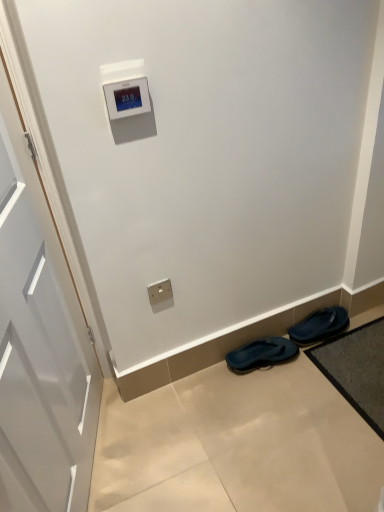
How much space does dark blue rubber flip-flops at lower right, the second footwear from the right, occupy vertically?

It is 3.65 inches.

This screenshot has width=384, height=512. I want to click on dark blue rubber flip-flops at lower right, the second footwear from the right, so click(x=261, y=354).

At what (x,y) coordinates should I click in order to perform the action: click on beige tile floor at lower center. Please return your answer as a coordinate pair (x, y). This screenshot has height=512, width=384. Looking at the image, I should click on (236, 445).

How different are the orientations of dark gray textured bath mat at lower right and beige tile floor at lower center in degrees?

The angular difference between dark gray textured bath mat at lower right and beige tile floor at lower center is 90 degrees.

Are dark gray textured bath mat at lower right and beige tile floor at lower center located far from each other?

No, dark gray textured bath mat at lower right is not far away from beige tile floor at lower center.

From the image's perspective, is dark gray textured bath mat at lower right on top of beige tile floor at lower center?

Yes.

Could you tell me if dark gray textured bath mat at lower right is facing beige tile floor at lower center?

Yes, dark gray textured bath mat at lower right is aimed at beige tile floor at lower center.

From a real-world perspective, which object rests below the other?

dark gray textured bath mat at lower right.

Are satin gold outlet at lower center and dark gray textured bath mat at lower right far apart?

satin gold outlet at lower center is near dark gray textured bath mat at lower right, not far away.

How many degrees apart are the facing directions of satin gold outlet at lower center and dark gray textured bath mat at lower right?

They differ by 90.1 degrees in their facing directions.

Locate an element on the screen. The height and width of the screenshot is (512, 384). bath mat located in front of the satin gold outlet at lower center is located at coordinates (356, 369).

How many degrees apart are the facing directions of beige tile floor at lower center and dark gray textured bath mat at lower right?

The angle between the facing direction of beige tile floor at lower center and the facing direction of dark gray textured bath mat at lower right is 90 degrees.

Which object is further away from the camera taking this photo, beige tile floor at lower center or dark gray textured bath mat at lower right?

dark gray textured bath mat at lower right is further away from the camera.

Considering the sizes of objects beige tile floor at lower center and dark gray textured bath mat at lower right in the image provided, who is shorter, beige tile floor at lower center or dark gray textured bath mat at lower right?

dark gray textured bath mat at lower right.

Based on their sizes in the image, would you say beige tile floor at lower center is bigger or smaller than dark gray textured bath mat at lower right?

Clearly, beige tile floor at lower center is larger in size than dark gray textured bath mat at lower right.

From the image's perspective, which footwear is the 1st one below the satin gold outlet at lower center? Please provide its 2D coordinates.

[(319, 325)]

Which of these two, black rubber slippers at lower right, the first footwear when ordered from right to left, or satin gold outlet at lower center, is wider?

black rubber slippers at lower right, the first footwear when ordered from right to left.

Considering the sizes of objects black rubber slippers at lower right, the first footwear when ordered from right to left, and satin gold outlet at lower center in the image provided, who is smaller, black rubber slippers at lower right, the first footwear when ordered from right to left, or satin gold outlet at lower center?

satin gold outlet at lower center is smaller.

Is satin gold outlet at lower center at the back of black rubber slippers at lower right, placed as the 2th footwear when sorted from left to right?

No, black rubber slippers at lower right, placed as the 2th footwear when sorted from left to right, is not facing away from satin gold outlet at lower center.

Does black rubber slippers at lower right, placed as the 2th footwear when sorted from left to right, turn towards dark blue rubber flip-flops at lower right, the 1th footwear viewed from the left?

No.

In the scene shown: In terms of size, does black rubber slippers at lower right, the first footwear when ordered from right to left, appear bigger or smaller than dark blue rubber flip-flops at lower right, the 1th footwear viewed from the left?

black rubber slippers at lower right, the first footwear when ordered from right to left, is smaller than dark blue rubber flip-flops at lower right, the 1th footwear viewed from the left.

How different are the orientations of black rubber slippers at lower right, the first footwear when ordered from right to left, and dark blue rubber flip-flops at lower right, the 1th footwear viewed from the left, in degrees?

The angle between the facing direction of black rubber slippers at lower right, the first footwear when ordered from right to left, and the facing direction of dark blue rubber flip-flops at lower right, the 1th footwear viewed from the left, is 0.00384 degrees.

From the image's perspective, which one is positioned higher, black rubber slippers at lower right, the first footwear when ordered from right to left, or dark blue rubber flip-flops at lower right, the 1th footwear viewed from the left?

black rubber slippers at lower right, the first footwear when ordered from right to left, from the image's perspective.

Can you see dark gray textured bath mat at lower right touching black rubber slippers at lower right, placed as the 2th footwear when sorted from left to right?

There is a gap between dark gray textured bath mat at lower right and black rubber slippers at lower right, placed as the 2th footwear when sorted from left to right.

Can we say dark gray textured bath mat at lower right lies outside black rubber slippers at lower right, the first footwear when ordered from right to left?

That's correct, dark gray textured bath mat at lower right is outside of black rubber slippers at lower right, the first footwear when ordered from right to left.

Which is closer, (365, 372) or (344, 310)?

Point (365, 372)

Is dark gray textured bath mat at lower right facing towards black rubber slippers at lower right, placed as the 2th footwear when sorted from left to right?

No, dark gray textured bath mat at lower right is not aimed at black rubber slippers at lower right, placed as the 2th footwear when sorted from left to right.

Is beige tile floor at lower center outside of satin gold outlet at lower center?

beige tile floor at lower center is positioned outside satin gold outlet at lower center.

Is point (302, 375) closer to camera compared to point (151, 298)?

That is False.

Is beige tile floor at lower center not close to satin gold outlet at lower center?

No, beige tile floor at lower center is not far away from satin gold outlet at lower center.

Could you tell me if beige tile floor at lower center is facing satin gold outlet at lower center?

No, beige tile floor at lower center is not oriented towards satin gold outlet at lower center.

The width and height of the screenshot is (384, 512). I want to click on bath mat behind the beige tile floor at lower center, so pyautogui.click(x=356, y=369).

Find the location of a particular element. The width and height of the screenshot is (384, 512). bath mat lying below the satin gold outlet at lower center (from the image's perspective) is located at coordinates (356, 369).

When comparing their distances from satin gold outlet at lower center, does black rubber slippers at lower right, the first footwear when ordered from right to left, or dark blue rubber flip-flops at lower right, the second footwear from the right, seem closer?

Based on the image, dark blue rubber flip-flops at lower right, the second footwear from the right, appears to be nearer to satin gold outlet at lower center.

Estimate the real-world distances between objects in this image. Which object is further from satin gold outlet at lower center, black rubber slippers at lower right, placed as the 2th footwear when sorted from left to right, or dark gray textured bath mat at lower right?

Based on the image, dark gray textured bath mat at lower right appears to be further to satin gold outlet at lower center.

When comparing their distances from satin gold outlet at lower center, does black rubber slippers at lower right, the first footwear when ordered from right to left, or beige tile floor at lower center seem closer?

beige tile floor at lower center is closer to satin gold outlet at lower center.

Looking at the image, which one is located further to black rubber slippers at lower right, placed as the 2th footwear when sorted from left to right, satin gold outlet at lower center or dark blue rubber flip-flops at lower right, the second footwear from the right?

satin gold outlet at lower center lies further to black rubber slippers at lower right, placed as the 2th footwear when sorted from left to right, than the other object.

When comparing their distances from dark blue rubber flip-flops at lower right, the second footwear from the right, does black rubber slippers at lower right, the first footwear when ordered from right to left, or dark gray textured bath mat at lower right seem closer?

The object closer to dark blue rubber flip-flops at lower right, the second footwear from the right, is black rubber slippers at lower right, the first footwear when ordered from right to left.

Estimate the real-world distances between objects in this image. Which object is further from black rubber slippers at lower right, the first footwear when ordered from right to left, satin gold outlet at lower center or beige tile floor at lower center?

satin gold outlet at lower center.

Estimate the real-world distances between objects in this image. Which object is closer to black rubber slippers at lower right, the first footwear when ordered from right to left, satin gold outlet at lower center or dark gray textured bath mat at lower right?

dark gray textured bath mat at lower right lies closer to black rubber slippers at lower right, the first footwear when ordered from right to left, than the other object.

When comparing their distances from dark blue rubber flip-flops at lower right, the 1th footwear viewed from the left, does black rubber slippers at lower right, the first footwear when ordered from right to left, or satin gold outlet at lower center seem further?

The object further to dark blue rubber flip-flops at lower right, the 1th footwear viewed from the left, is satin gold outlet at lower center.

This screenshot has width=384, height=512. In order to click on footwear between dark blue rubber flip-flops at lower right, the second footwear from the right, and dark gray textured bath mat at lower right from left to right in this screenshot , I will do coord(319,325).

Locate an element on the screen. electric outlet between beige tile floor at lower center and black rubber slippers at lower right, placed as the 2th footwear when sorted from left to right, in the front-back direction is located at coordinates (160, 291).

Where is `electric outlet between beige tile floor at lower center and dark blue rubber flip-flops at lower right, the 1th footwear viewed from the left, in the front-back direction`? electric outlet between beige tile floor at lower center and dark blue rubber flip-flops at lower right, the 1th footwear viewed from the left, in the front-back direction is located at coordinates (160, 291).

Locate an element on the screen. bath mat between beige tile floor at lower center and dark blue rubber flip-flops at lower right, the second footwear from the right, along the z-axis is located at coordinates (356, 369).